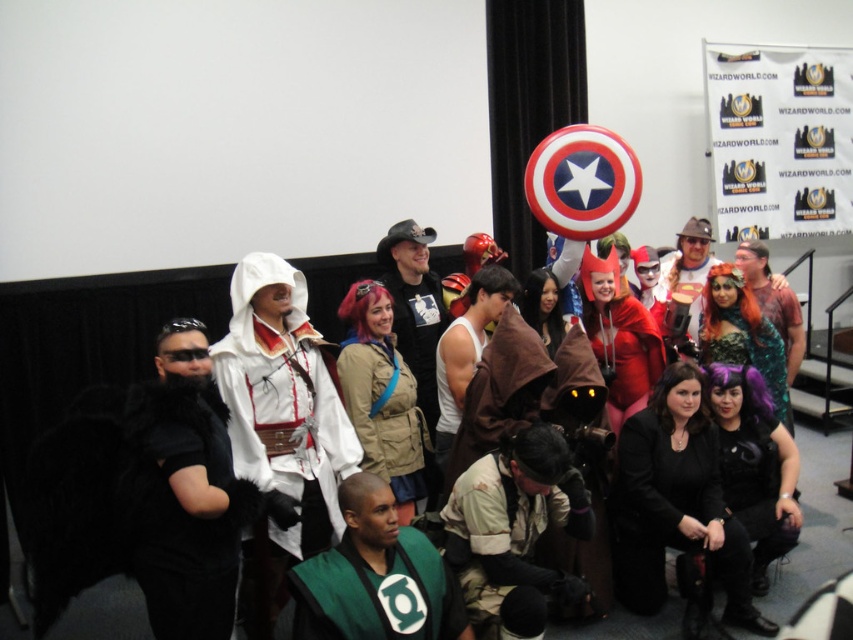
Is the position of tan fabric jacket at center more distant than that of white matte tank top at center?

No, tan fabric jacket at center is in front of white matte tank top at center.

Is tan fabric jacket at center closer to the viewer compared to white matte tank top at center?

That is True.

Is point (376, 358) behind point (457, 412)?

No, it is in front of (457, 412).

Find the location of a particular element. This screenshot has height=640, width=853. tan fabric jacket at center is located at coordinates (387, 419).

Image resolution: width=853 pixels, height=640 pixels. Find the location of `black leather jacket at center`. black leather jacket at center is located at coordinates (415, 307).

Measure the distance between black leather jacket at center and camera.

black leather jacket at center is 3.67 meters from camera.

I want to click on black leather jacket at center, so click(415, 307).

Does white satin robe at center have a greater width compared to matte brown hat at center?

Indeed, white satin robe at center has a greater width compared to matte brown hat at center.

Describe the element at coordinates (282, 426) in the screenshot. This screenshot has width=853, height=640. I see `white satin robe at center` at that location.

You are a GUI agent. You are given a task and a screenshot of the screen. Output one action in this format:
    pyautogui.click(x=<x>, y=<y>)
    Task: Click on the white satin robe at center
    The image size is (853, 640).
    Given the screenshot: What is the action you would take?
    pyautogui.click(x=282, y=426)